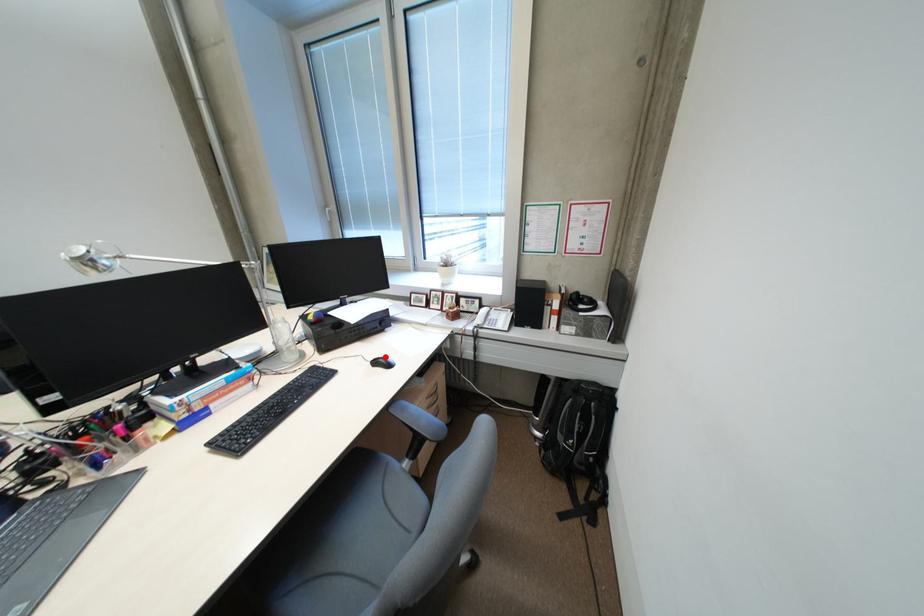
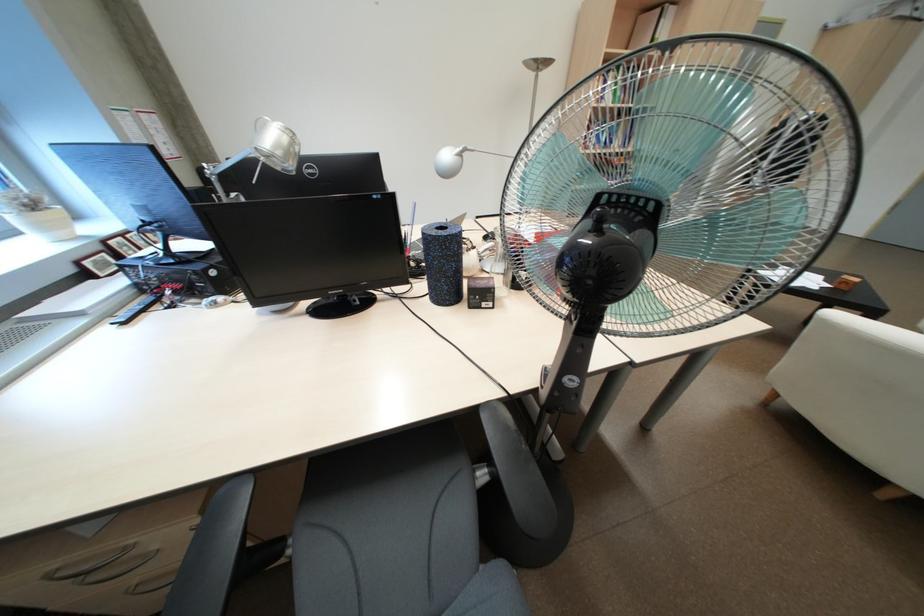
Question: I am providing you with two images of the same scene from different viewpoints. A red point is marked on the first image. Is the red point's position out of view in image 2?

Choices:
 (A) Yes
 (B) No

Answer: (A)